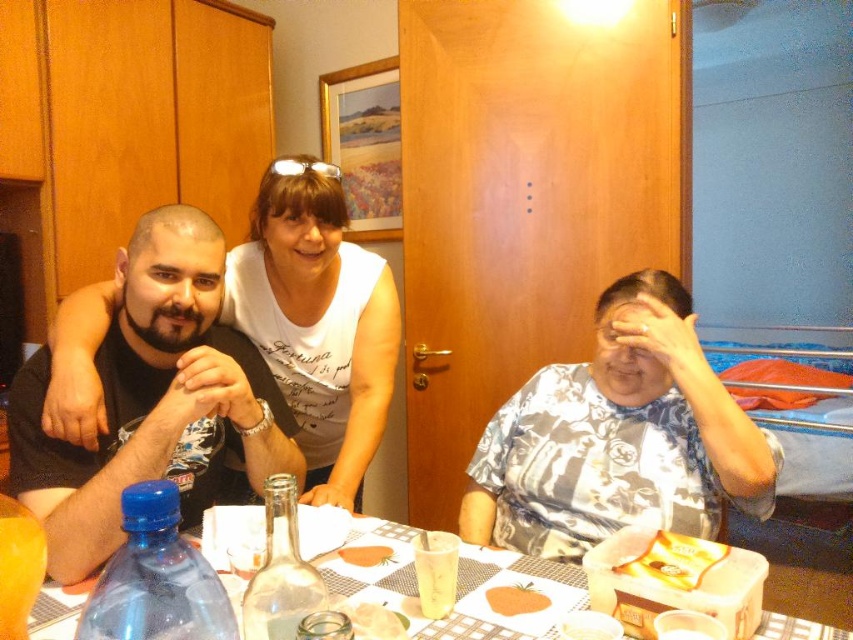
Question: Is transparent glass bottle at center to the right of translucent glass jar at table center from the viewer's perspective?

Choices:
 (A) no
 (B) yes

Answer: (A)

Question: Is the position of blue plastic bottle at lower left less distant than that of translucent glass jar at table center?

Choices:
 (A) yes
 (B) no

Answer: (A)

Question: Considering the real-world distances, which object is closest to the white plastic table at center?

Choices:
 (A) translucent glass cup at table center
 (B) black matte shirt at left
 (C) translucent glass jar at table center

Answer: (A)

Question: Estimate the real-world distances between objects in this image. Which object is closer to the white plastic table at center?

Choices:
 (A) yellow matte snack packet at lower right
 (B) orange matte carrot at center
 (C) blue plastic bottle at lower left

Answer: (B)

Question: Which point appears farthest from the camera in this image?

Choices:
 (A) coord(550,374)
 (B) coord(198,589)
 (C) coord(267,502)
 (D) coord(654,572)

Answer: (A)

Question: Does white floral shirt at lower right appear on the left side of yellow matte snack packet at lower right?

Choices:
 (A) no
 (B) yes

Answer: (A)